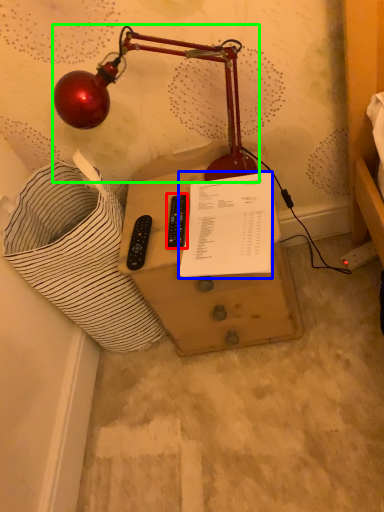
Question: Based on their relative distances, which object is nearer to control (highlighted by a red box)? Choose from document (highlighted by a blue box) and lamp (highlighted by a green box).

Choices:
 (A) document
 (B) lamp

Answer: (A)